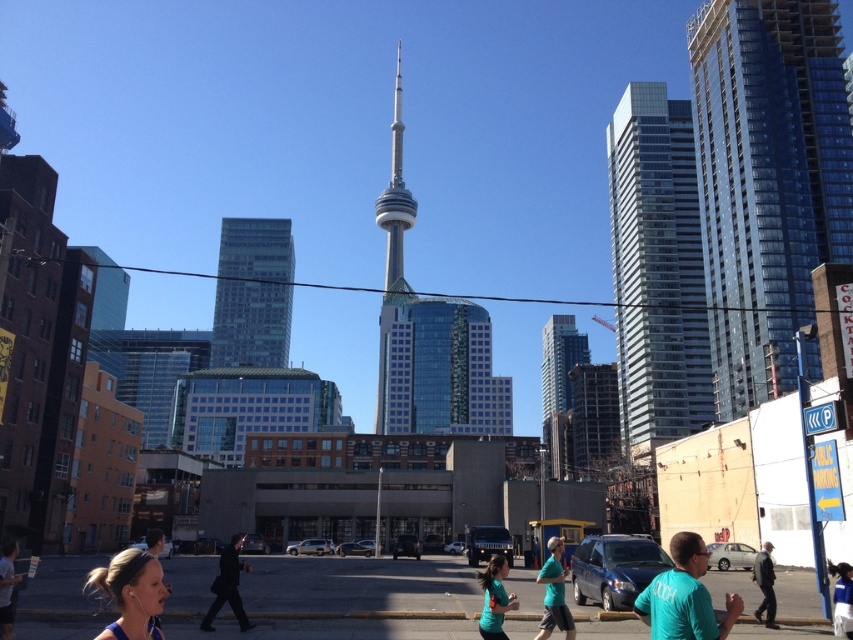
Is black matte suit at center below teal t-shirt at lower left?

Yes.

Can you confirm if black matte suit at center is positioned above teal t-shirt at lower left?

No, black matte suit at center is not above teal t-shirt at lower left.

This screenshot has width=853, height=640. Describe the element at coordinates (227, 586) in the screenshot. I see `black matte suit at center` at that location.

The height and width of the screenshot is (640, 853). I want to click on black matte suit at center, so click(x=227, y=586).

Based on the photo, is glassy blue skyscraper at right thinner than glassy skyscraper at center?

In fact, glassy blue skyscraper at right might be wider than glassy skyscraper at center.

Is point (752, 168) closer to viewer compared to point (550, 401)?

Yes.

Is point (751, 186) closer to viewer compared to point (547, 344)?

Yes.

Image resolution: width=853 pixels, height=640 pixels. In order to click on glassy blue skyscraper at right in this screenshot , I will do `click(766, 180)`.

Measure the distance between glassy reflective skyscraper at center and teal fabric shirt at center.

glassy reflective skyscraper at center is 593.83 feet away from teal fabric shirt at center.

Who is more forward, (247, 348) or (564, 602)?

Point (564, 602) is in front.

At what (x,y) coordinates should I click in order to perform the action: click on glassy reflective skyscraper at center. Please return your answer as a coordinate pair (x, y). Image resolution: width=853 pixels, height=640 pixels. Looking at the image, I should click on (252, 292).